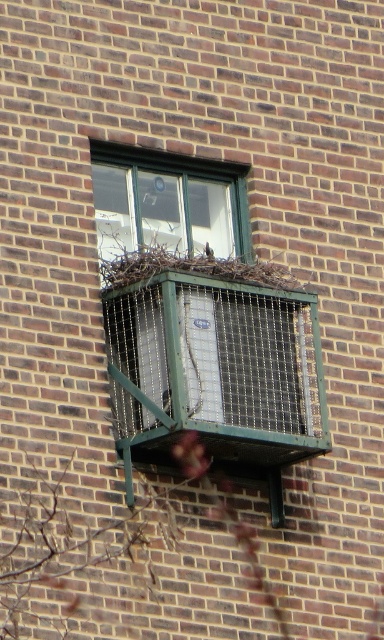
Question: Which is farther from the green glass window at upper center?

Choices:
 (A) brown textured nest at center
 (B) green mesh air conditioner at center
 (C) brown textured twig at lower left
 (D) green mesh bird cage at center

Answer: (C)

Question: Among these points, which one is nearest to the camera?

Choices:
 (A) (115, 240)
 (B) (213, 502)
 (C) (190, 168)
 (D) (226, 241)

Answer: (B)

Question: Does green mesh bird cage at center lie in front of green mesh air conditioner at center?

Choices:
 (A) yes
 (B) no

Answer: (A)

Question: Does green mesh bird cage at center have a smaller size compared to brown textured nest at center?

Choices:
 (A) no
 (B) yes

Answer: (A)

Question: Among these objects, which one is farthest from the camera?

Choices:
 (A) brown textured nest at center
 (B) brown textured twig at lower left
 (C) green glass window at upper center

Answer: (C)

Question: Does brown textured twig at lower left have a larger size compared to brown textured nest at center?

Choices:
 (A) yes
 (B) no

Answer: (B)